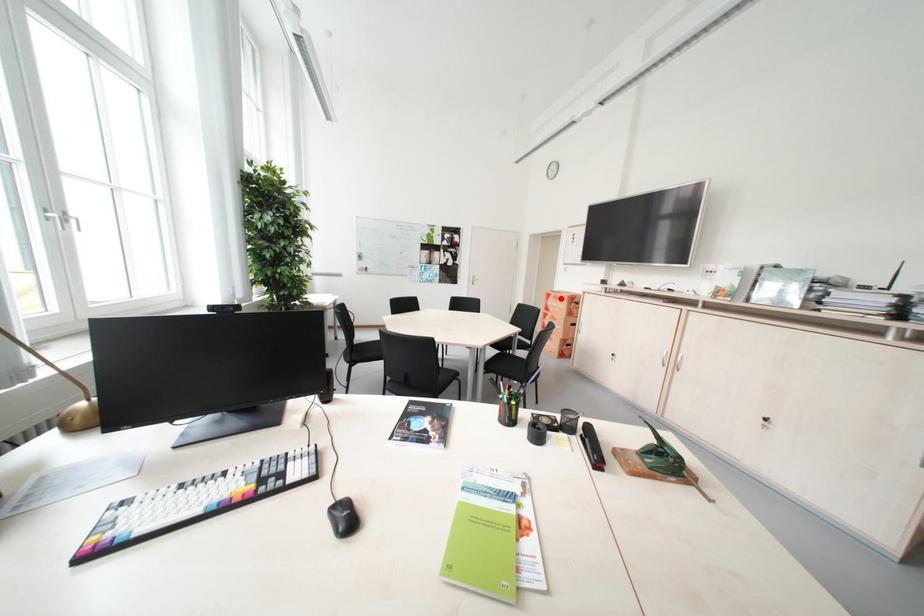
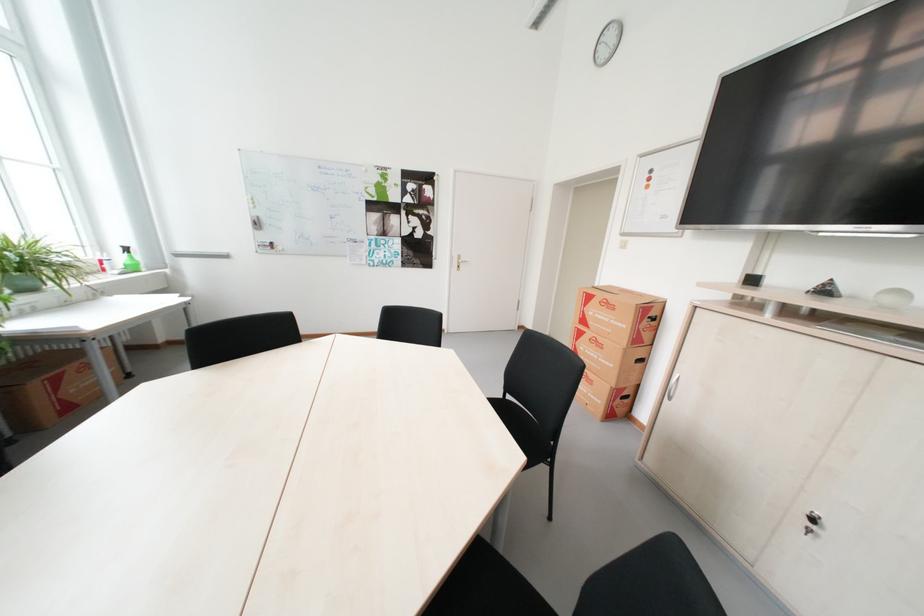
Locate, in the second image, the point that corresponds to the highlighted location in the first image.

(604, 302)